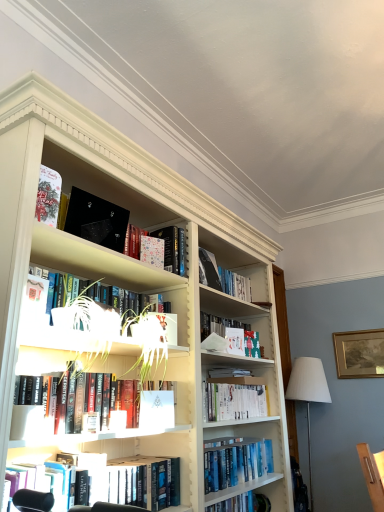
Question: From the image's perspective, is matte black book at upper left, positioned as the fourth paperback book in right-to-left order, located above or below white fabric lampshade at right?

Choices:
 (A) below
 (B) above

Answer: (B)

Question: Is matte black book at upper left, positioned as the fourth paperback book in right-to-left order, in front of or behind white fabric lampshade at right in the image?

Choices:
 (A) behind
 (B) front

Answer: (B)

Question: Which of these objects is positioned closest to the hardcover books at center, the fourth book positioned from the bottom?

Choices:
 (A) gold-framed picture at upper right
 (B) hardcover book at center, which appears as the fifth book when viewed from the top
 (C) white fabric lampshade at right
 (D) matte white book at center, which ranks as the fourth paperback book in left-to-right order
 (E) white matte paper at center, arranged as the third paperback book when viewed from the back

Answer: (E)

Question: Which object is positioned closest to the hardcover book at lower center, marked as the second book in a bottom-to-top arrangement?

Choices:
 (A) white matte paper at center, the third paperback book positioned from the left
 (B) hardcover book at center, marked as the 3th book in a bottom-to-top arrangement
 (C) hardcover book at center, the first book from the bottom
 (D) hardcover book at center, which is counted as the 3th book, starting from the top
 (E) matte red book at upper left, which is counted as the first book, starting from the top

Answer: (A)